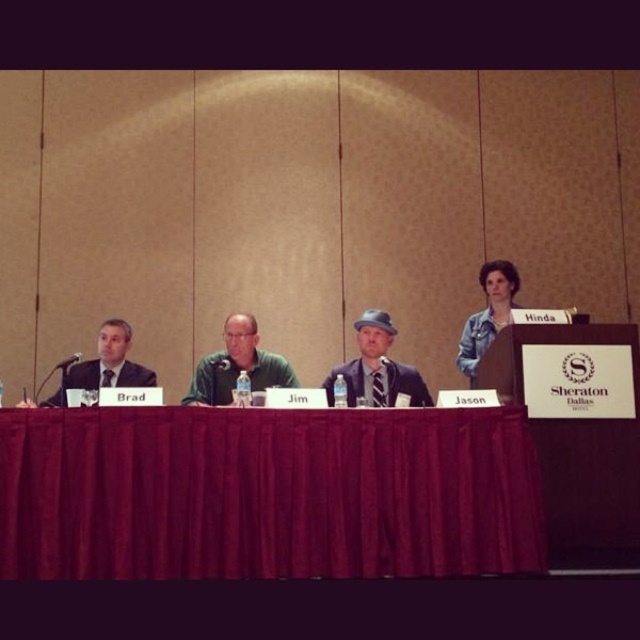
Question: Which object is the closest to the matte black suit at left?

Choices:
 (A) matte black suit at center
 (B) blue jean jacket at upper right
 (C) green matte shirt at center
 (D) velvet red table at center

Answer: (C)

Question: Observing the image, what is the correct spatial positioning of matte black suit at center in reference to blue jean jacket at upper right?

Choices:
 (A) right
 (B) left

Answer: (B)

Question: Observing the image, what is the correct spatial positioning of matte black suit at center in reference to green matte shirt at center?

Choices:
 (A) right
 (B) left

Answer: (A)

Question: Can you confirm if velvet red table at center is positioned to the left of green matte shirt at center?

Choices:
 (A) yes
 (B) no

Answer: (B)

Question: Which of the following is the farthest from the observer?

Choices:
 (A) matte black suit at center
 (B) blue jean jacket at upper right

Answer: (B)

Question: Which point is farther to the camera?

Choices:
 (A) (188, 400)
 (B) (298, 529)

Answer: (A)